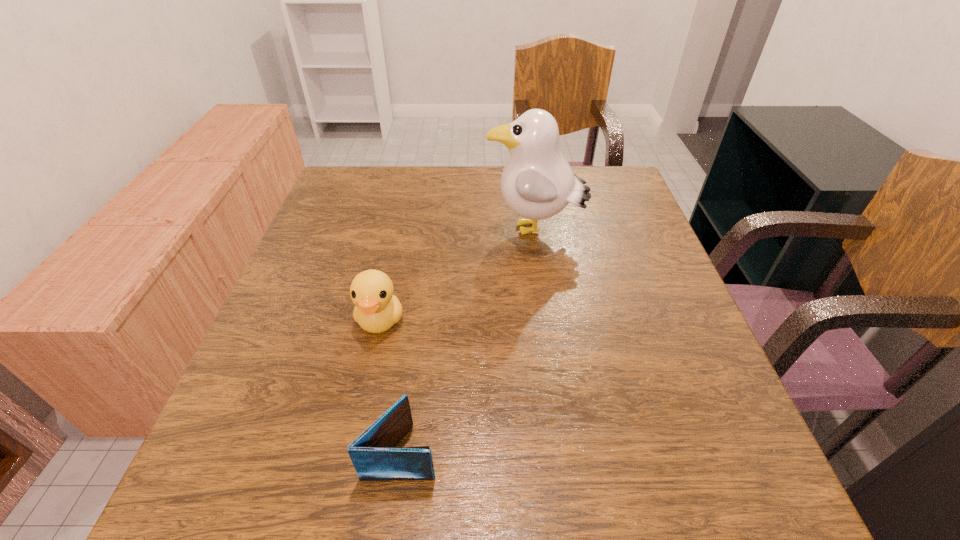
Where is `vacant region that satisfies the following two spatial constraints: 1. on the beak of the farthest object; 2. on the face of the duck`? This screenshot has height=540, width=960. vacant region that satisfies the following two spatial constraints: 1. on the beak of the farthest object; 2. on the face of the duck is located at coordinates (546, 320).

Image resolution: width=960 pixels, height=540 pixels. Find the location of `free space that satisfies the following two spatial constraints: 1. on the beak of the rightmost object; 2. on the face of the second shortest object`. free space that satisfies the following two spatial constraints: 1. on the beak of the rightmost object; 2. on the face of the second shortest object is located at coordinates (546, 320).

The height and width of the screenshot is (540, 960). Identify the location of vacant point that satisfies the following two spatial constraints: 1. on the beak of the farthest object; 2. on the face of the second nearest object. [546, 320].

Identify the location of free space that satisfies the following two spatial constraints: 1. on the beak of the rightmost object; 2. on the face of the second nearest object. (546, 320).